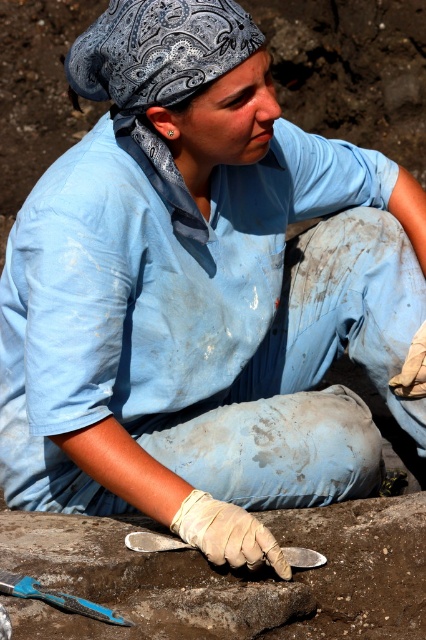
How much distance is there between smooth gray cement at lower center and blue plastic trowel at lower left?

smooth gray cement at lower center is 10.25 inches from blue plastic trowel at lower left.

Can you confirm if smooth gray cement at lower center is shorter than blue plastic trowel at lower left?

Incorrect, smooth gray cement at lower center's height does not fall short of blue plastic trowel at lower left's.

Does point (106, 636) come farther from viewer compared to point (66, 596)?

No, it is in front of (66, 596).

The height and width of the screenshot is (640, 426). I want to click on smooth gray cement at lower center, so click(x=351, y=572).

From the picture: Is the position of blue plastic trowel at lower left more distant than that of metallic silver trowel at center?

No, it is in front of metallic silver trowel at center.

Does blue plastic trowel at lower left have a lesser width compared to metallic silver trowel at center?

No.

The image size is (426, 640). What do you see at coordinates (57, 598) in the screenshot?
I see `blue plastic trowel at lower left` at bounding box center [57, 598].

Locate an element on the screen. The height and width of the screenshot is (640, 426). blue plastic trowel at lower left is located at coordinates (57, 598).

Describe the element at coordinates (351, 572) in the screenshot. This screenshot has height=640, width=426. I see `smooth gray cement at lower center` at that location.

Which is behind, point (117, 598) or point (126, 544)?

The point (126, 544) is more distant.

Locate an element on the screen. This screenshot has width=426, height=640. smooth gray cement at lower center is located at coordinates (351, 572).